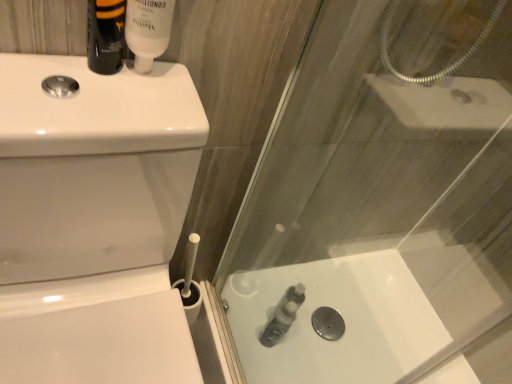
Question: Considering the positions of translucent plastic bottle at lower center and white glossy tube at upper center, which ranks as the third toiletry in bottom-to-top order, in the image, is translucent plastic bottle at lower center wider or thinner than white glossy tube at upper center, which ranks as the third toiletry in bottom-to-top order,?

Choices:
 (A) wide
 (B) thin

Answer: (A)

Question: Considering the positions of translucent plastic bottle at lower center and white glossy tube at upper center, which is the 2th toiletry in left-to-right order, in the image, is translucent plastic bottle at lower center bigger or smaller than white glossy tube at upper center, which is the 2th toiletry in left-to-right order,?

Choices:
 (A) small
 (B) big

Answer: (B)

Question: Which object is the closest to the matte black bottle at upper left, the first toiletry viewed from the left?

Choices:
 (A) translucent plastic bottle at lower center
 (B) translucent plastic bottle at lower center, which is counted as the 3th toiletry, starting from the left
 (C) white glossy toilet bowl at left
 (D) white glossy tube at upper center, which is the 2th toiletry in left-to-right order

Answer: (D)

Question: Which object is positioned closest to the translucent plastic bottle at lower center, marked as the 1th toiletry in a bottom-to-top arrangement?

Choices:
 (A) white glossy toilet bowl at left
 (B) matte black bottle at upper left, the first toiletry viewed from the left
 (C) white glossy tube at upper center, the second toiletry positioned from the front
 (D) translucent plastic bottle at lower center

Answer: (D)